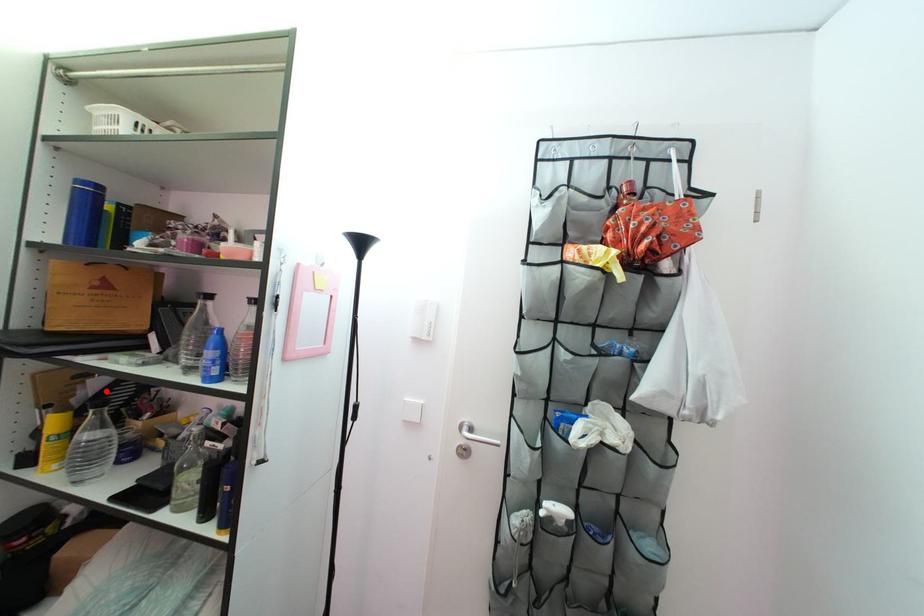
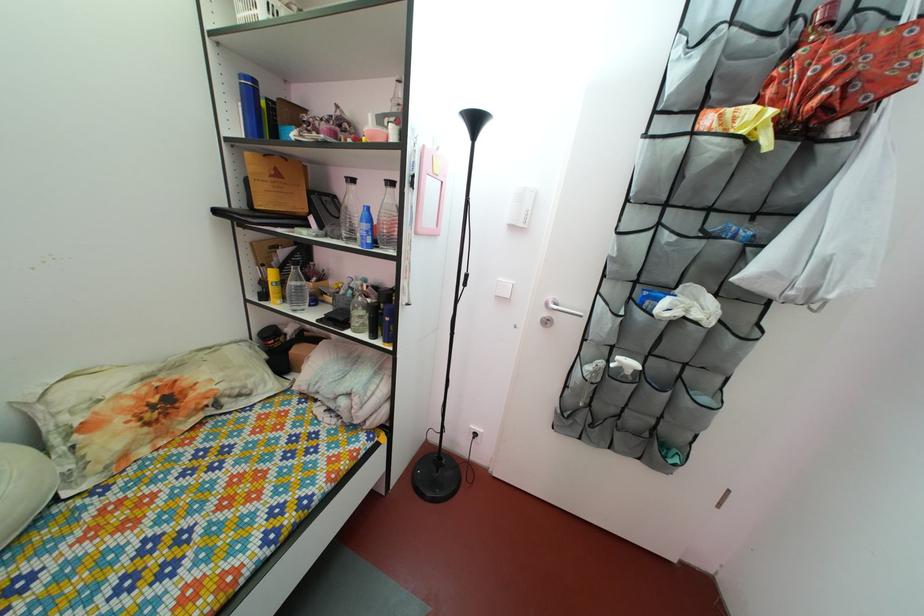
Question: I am providing you with two images of the same scene from different viewpoints. A red point is marked on the first image. Is the red point's position out of view in image 2?

Choices:
 (A) Yes
 (B) No

Answer: (B)